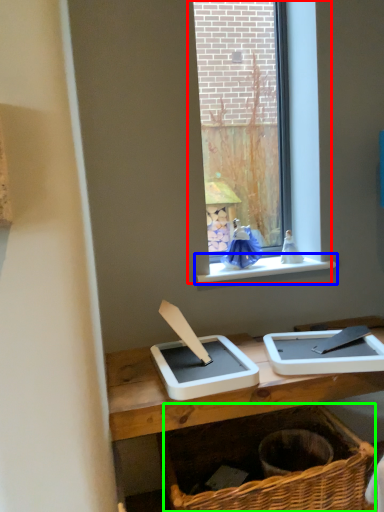
Question: Based on their relative distances, which object is farther from window (highlighted by a red box)? Choose from window sill (highlighted by a blue box) and basket (highlighted by a green box).

Choices:
 (A) window sill
 (B) basket

Answer: (B)